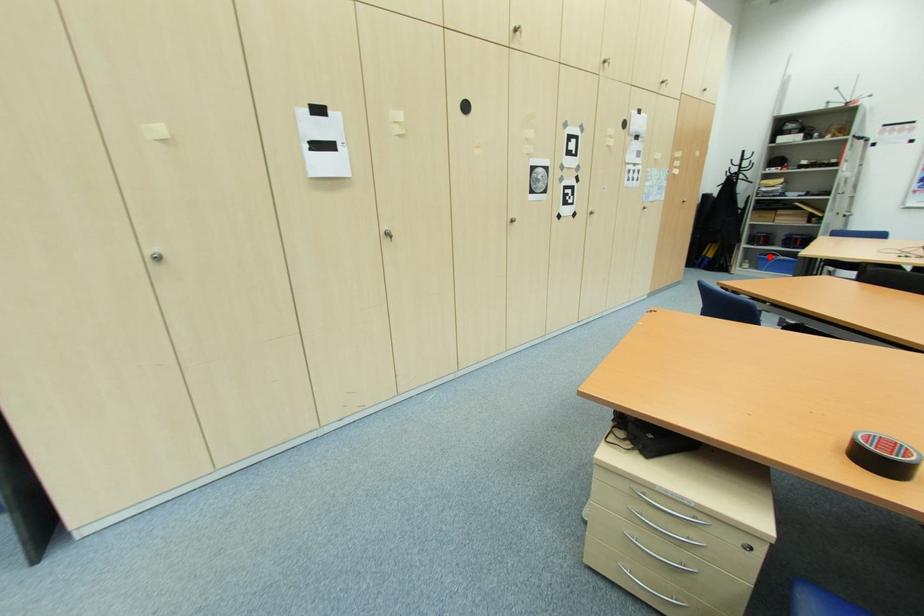
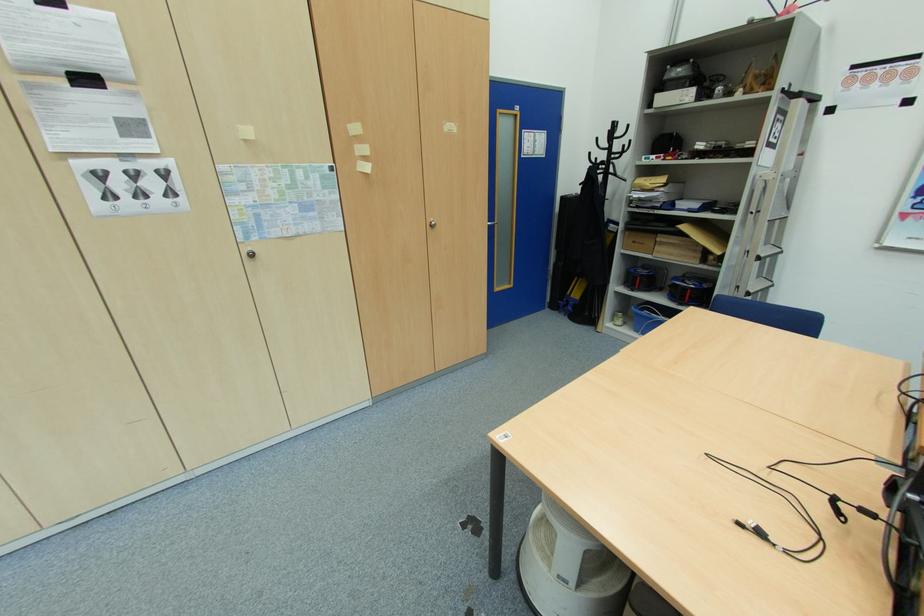
Find the pixel in the second image that matches the highlighted location in the first image.

(646, 310)